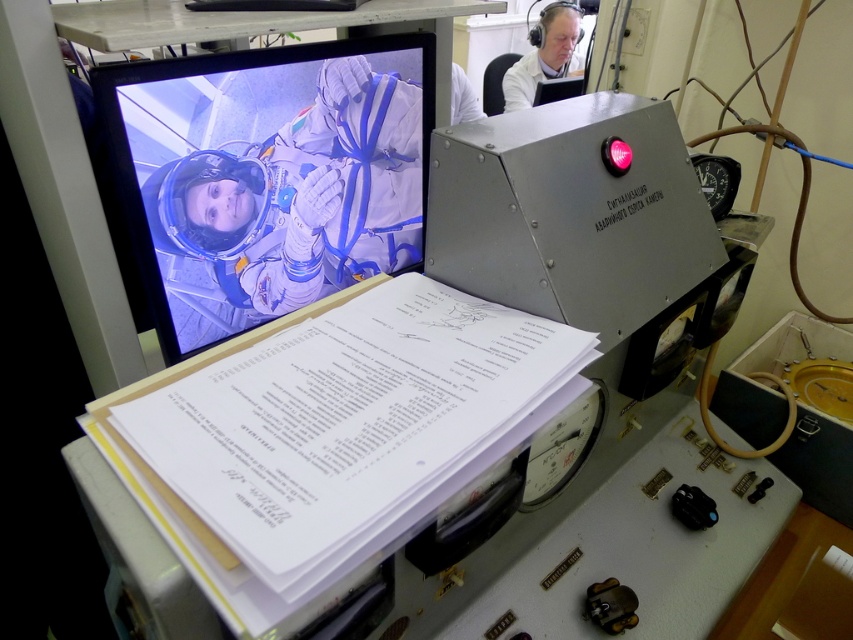
Question: Among these objects, which one is nearest to the camera?

Choices:
 (A) shiny plastic monitor at upper left
 (B) white lab coat at upper right
 (C) white paper at center

Answer: (C)

Question: Which of the following is the farthest from the observer?

Choices:
 (A) (146, 84)
 (B) (399, 388)

Answer: (A)

Question: Which point is farther to the camera?

Choices:
 (A) (573, 33)
 (B) (340, 259)
 (C) (263, 360)

Answer: (A)

Question: Is white paper at center positioned behind white lab coat at upper right?

Choices:
 (A) yes
 (B) no

Answer: (B)

Question: Considering the relative positions of shiny plastic monitor at upper left and white lab coat at upper right in the image provided, where is shiny plastic monitor at upper left located with respect to white lab coat at upper right?

Choices:
 (A) left
 (B) right

Answer: (A)

Question: Where is white paper at center located in relation to white lab coat at upper right in the image?

Choices:
 (A) above
 (B) below

Answer: (B)